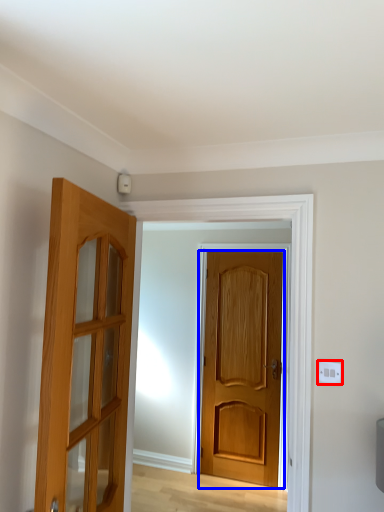
Question: Which of the following is the farthest to the observer, electric outlet (highlighted by a red box) or door (highlighted by a blue box)?

Choices:
 (A) electric outlet
 (B) door

Answer: (B)